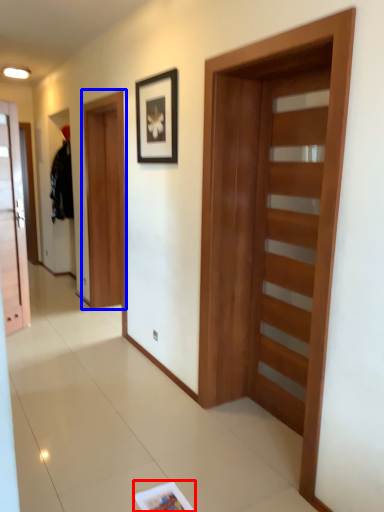
Question: Which object appears farthest to the camera in this image, magazine (highlighted by a red box) or barn door (highlighted by a blue box)?

Choices:
 (A) magazine
 (B) barn door

Answer: (B)